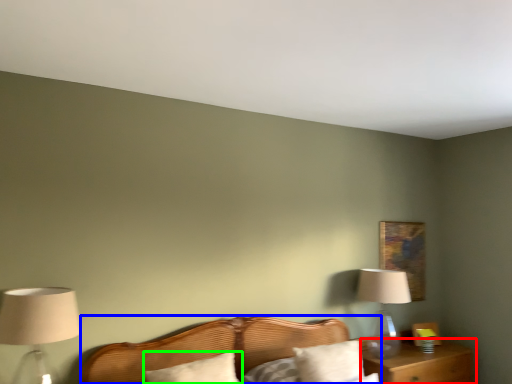
Question: Based on their relative distances, which object is nearer to nightstand (highlighted by a red box)? Choose from bed (highlighted by a blue box) and pillow (highlighted by a green box).

Choices:
 (A) bed
 (B) pillow

Answer: (A)